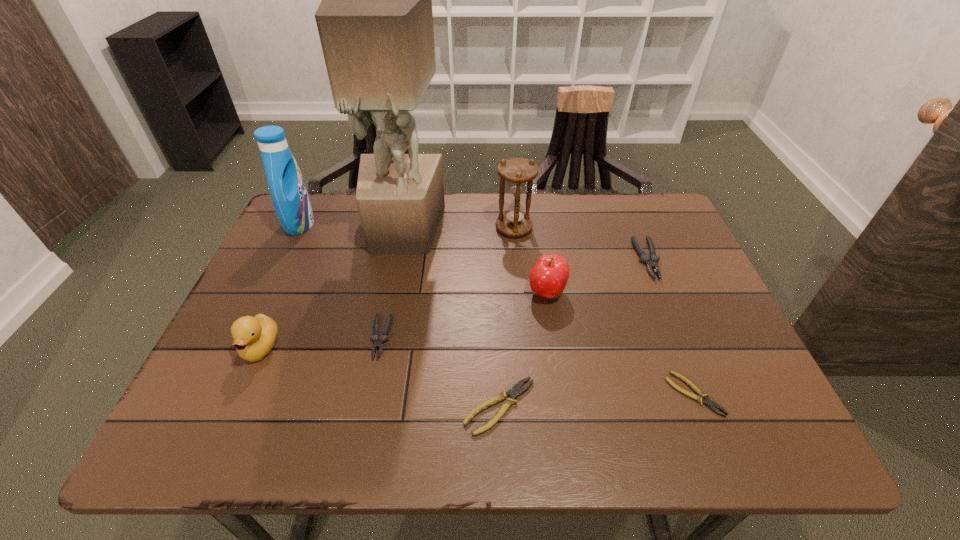
Where is `the bigger yellow pliers`? This screenshot has height=540, width=960. the bigger yellow pliers is located at coordinates (515, 390).

At what (x,y) coordinates should I click in order to perform the action: click on the second pliers from left to right. Please return your answer as a coordinate pair (x, y). This screenshot has height=540, width=960. Looking at the image, I should click on (515, 390).

What are the coordinates of `the shortest object` in the screenshot? It's located at (712, 405).

Locate an element on the screen. The height and width of the screenshot is (540, 960). the right yellow pliers is located at coordinates (712, 405).

Image resolution: width=960 pixels, height=540 pixels. In order to click on free space located on the front-facing side of the sculpture in this screenshot , I will do `click(374, 374)`.

This screenshot has height=540, width=960. I want to click on free space located 0.350m on the front-facing side of the second tallest object, so click(433, 224).

This screenshot has width=960, height=540. What are the coordinates of `vacant point located on the front of the hourglass` in the screenshot? It's located at (523, 328).

You are a GUI agent. You are given a task and a screenshot of the screen. Output one action in this format:
    pyautogui.click(x=<x>, y=<y>)
    Task: Click on the free space located on the front of the apple
    Image resolution: width=960 pixels, height=540 pixels.
    Given the screenshot: What is the action you would take?
    pyautogui.click(x=564, y=406)

The height and width of the screenshot is (540, 960). I want to click on vacant space located 0.060m facing forward on the duckling, so click(x=240, y=395).

This screenshot has width=960, height=540. Identify the location of vacant space located 0.310m at the gripping part of the farthest pliers. (701, 389).